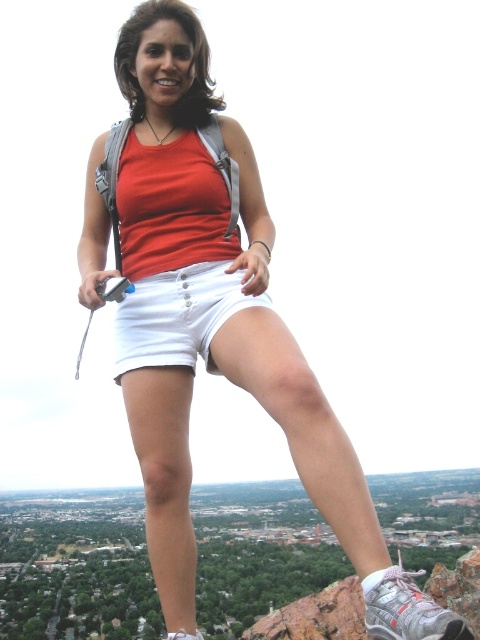
You are a photographer capturing the scene of a person on a rocky outcrop. You notice the white cotton shorts at center and the matte red tank top at center. Which clothing item appears closer to you in the photo?

The white cotton shorts at center appears closer to you because it is further to the viewer than the matte red tank top at center.

You are a photographer trying to capture the perfect shot of the landscape. You notice the white cotton shorts at center in your frame. Based on their position, can you estimate where exactly they are located in the image?

The white cotton shorts at center are located at the coordinates point [177,316] in the image.